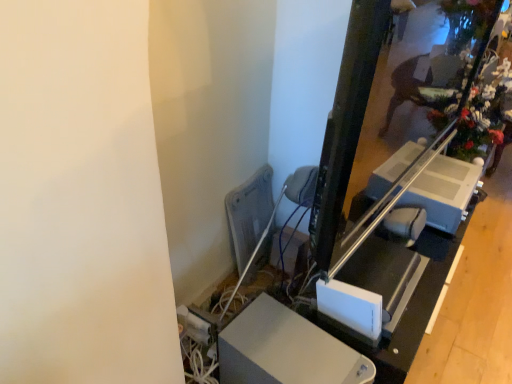
Question: Is white plastic speaker at center shorter than white plastic table at center?

Choices:
 (A) no
 (B) yes

Answer: (A)

Question: Does white plastic speaker at center have a greater height compared to white plastic table at center?

Choices:
 (A) no
 (B) yes

Answer: (B)

Question: Can white plastic table at center be found inside white plastic speaker at center?

Choices:
 (A) no
 (B) yes

Answer: (A)

Question: Does white plastic speaker at center lie behind white plastic table at center?

Choices:
 (A) yes
 (B) no

Answer: (B)

Question: Is white plastic speaker at center aimed at white plastic table at center?

Choices:
 (A) yes
 (B) no

Answer: (B)

Question: Considering the positions of point (445, 173) and point (247, 273), is point (445, 173) closer or farther from the camera than point (247, 273)?

Choices:
 (A) farther
 (B) closer

Answer: (A)

Question: Is white plastic lift at right in front of or behind gray metallic radiator at center in the image?

Choices:
 (A) behind
 (B) front

Answer: (A)

Question: From the image's perspective, is white plastic lift at right located above or below gray metallic radiator at center?

Choices:
 (A) above
 (B) below

Answer: (A)

Question: Is white plastic lift at right to the left or to the right of gray metallic radiator at center in the image?

Choices:
 (A) left
 (B) right

Answer: (B)

Question: Considering the positions of white plastic table at center and white plastic speaker at center in the image, is white plastic table at center taller or shorter than white plastic speaker at center?

Choices:
 (A) tall
 (B) short

Answer: (B)

Question: From a real-world perspective, is white plastic table at center above or below white plastic speaker at center?

Choices:
 (A) below
 (B) above

Answer: (A)

Question: From the image's perspective, relative to white plastic speaker at center, is white plastic table at center above or below?

Choices:
 (A) below
 (B) above

Answer: (B)

Question: Looking at their shapes, would you say white plastic table at center is wider or thinner than white plastic speaker at center?

Choices:
 (A) wide
 (B) thin

Answer: (B)

Question: In the image, is white plastic table at center on the left side or the right side of white plastic lift at right?

Choices:
 (A) left
 (B) right

Answer: (A)

Question: Which is correct: white plastic table at center is inside white plastic lift at right, or outside of it?

Choices:
 (A) inside
 (B) outside

Answer: (B)